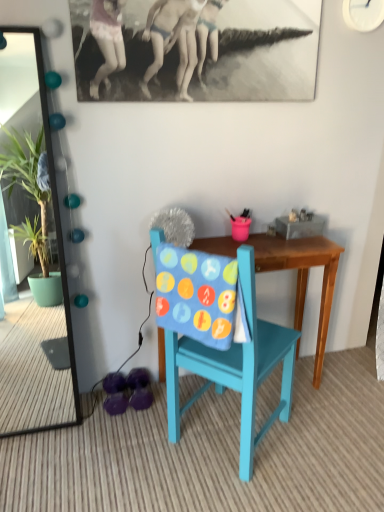
Find the location of a particular element. The image size is (384, 512). vacant space that is in between wooden table at center and purple fabric footwear at lower left is located at coordinates (153, 406).